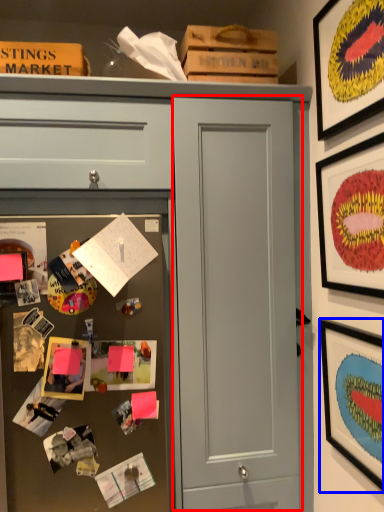
Question: Among these objects, which one is nearest to the camera, door (highlighted by a red box) or picture frame (highlighted by a blue box)?

Choices:
 (A) door
 (B) picture frame

Answer: (B)